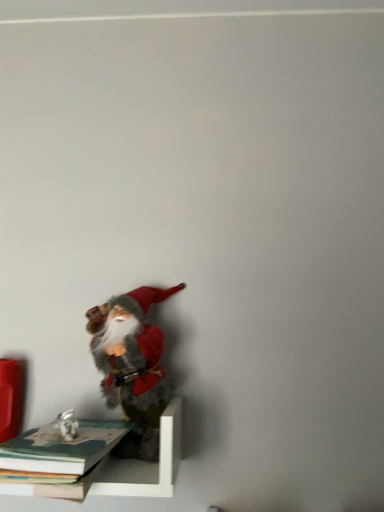
Consider the image. Measure the distance between hardcover book at lower left, which appears as the second book when ordered from the bottom, and camera.

They are 60.93 centimeters apart.

How much space does hardcover book at lower left, which appears as the second book when ordered from the bottom, occupy horizontally?

The width of hardcover book at lower left, which appears as the second book when ordered from the bottom, is 11.10 inches.

Describe the element at coordinates (50, 485) in the screenshot. I see `hardcover book at lower left, positioned as the first book in bottom-to-top order` at that location.

I want to click on white matte shelf at lower left, so click(123, 470).

This screenshot has width=384, height=512. I want to click on hardcover book at lower left, which ranks as the 1th book in top-to-bottom order, so click(62, 448).

Considering the positions of objects white matte shelf at lower left and fuzzy felt santa at lower left in the image provided, who is more to the right, white matte shelf at lower left or fuzzy felt santa at lower left?

Positioned to the right is fuzzy felt santa at lower left.

From the image's perspective, is white matte shelf at lower left located above or below fuzzy felt santa at lower left?

white matte shelf at lower left is below fuzzy felt santa at lower left.

The image size is (384, 512). What are the coordinates of `person above the white matte shelf at lower left (from a real-world perspective)` in the screenshot? It's located at (132, 366).

Looking at this image, is hardcover book at lower left, which appears as the second book when ordered from the bottom, wider or thinner than fuzzy felt santa at lower left?

In the image, hardcover book at lower left, which appears as the second book when ordered from the bottom, appears to be wider than fuzzy felt santa at lower left.

Considering the sizes of objects hardcover book at lower left, which appears as the second book when ordered from the bottom, and fuzzy felt santa at lower left in the image provided, who is shorter, hardcover book at lower left, which appears as the second book when ordered from the bottom, or fuzzy felt santa at lower left?

With less height is hardcover book at lower left, which appears as the second book when ordered from the bottom.

Considering the sizes of hardcover book at lower left, which appears as the second book when ordered from the bottom, and fuzzy felt santa at lower left in the image, is hardcover book at lower left, which appears as the second book when ordered from the bottom, bigger or smaller than fuzzy felt santa at lower left?

hardcover book at lower left, which appears as the second book when ordered from the bottom, is smaller than fuzzy felt santa at lower left.

Is point (4, 458) closer to camera compared to point (136, 433)?

Yes, point (4, 458) is in front of point (136, 433).

Is white matte shelf at lower left closer to the viewer compared to hardcover book at lower left, which appears as the second book when ordered from the bottom?

No, white matte shelf at lower left is further to the viewer.

Can you confirm if white matte shelf at lower left is thinner than hardcover book at lower left, which appears as the second book when ordered from the bottom?

Yes, white matte shelf at lower left is thinner than hardcover book at lower left, which appears as the second book when ordered from the bottom.

Does white matte shelf at lower left have a greater height compared to hardcover book at lower left, which ranks as the 1th book in top-to-bottom order?

Indeed, white matte shelf at lower left has a greater height compared to hardcover book at lower left, which ranks as the 1th book in top-to-bottom order.

Can you tell me how much white matte shelf at lower left and hardcover book at lower left, which appears as the second book when ordered from the bottom, differ in facing direction?

2.74 degrees separate the facing orientations of white matte shelf at lower left and hardcover book at lower left, which appears as the second book when ordered from the bottom.

Consider the image. Considering the sizes of objects fuzzy felt santa at lower left and hardcover book at lower left, which is the second book from top to bottom, in the image provided, who is bigger, fuzzy felt santa at lower left or hardcover book at lower left, which is the second book from top to bottom,?

fuzzy felt santa at lower left is bigger.

Visually, is fuzzy felt santa at lower left positioned to the left or to the right of hardcover book at lower left, which is the second book from top to bottom?

Based on their positions, fuzzy felt santa at lower left is located to the right of hardcover book at lower left, which is the second book from top to bottom.

Can you confirm if fuzzy felt santa at lower left is taller than hardcover book at lower left, positioned as the first book in bottom-to-top order?

Indeed, fuzzy felt santa at lower left has a greater height compared to hardcover book at lower left, positioned as the first book in bottom-to-top order.

Is point (120, 335) closer to viewer compared to point (90, 471)?

No, it is not.

Can you tell me how much fuzzy felt santa at lower left and hardcover book at lower left, which ranks as the 1th book in top-to-bottom order, differ in facing direction?

The angular difference between fuzzy felt santa at lower left and hardcover book at lower left, which ranks as the 1th book in top-to-bottom order, is 2.45 degrees.

Looking at this image, choose the correct answer: Is fuzzy felt santa at lower left inside hardcover book at lower left, which ranks as the 1th book in top-to-bottom order, or outside it?

The correct answer is: outside.

Is fuzzy felt santa at lower left oriented away from hardcover book at lower left, which ranks as the 1th book in top-to-bottom order?

No, hardcover book at lower left, which ranks as the 1th book in top-to-bottom order, is not at the back of fuzzy felt santa at lower left.

From the image's perspective, is hardcover book at lower left, which appears as the second book when ordered from the bottom, located beneath hardcover book at lower left, which is the second book from top to bottom?

Incorrect, from the image's perspective, hardcover book at lower left, which appears as the second book when ordered from the bottom, is higher than hardcover book at lower left, which is the second book from top to bottom.

Considering the positions of points (43, 463) and (14, 482), is point (43, 463) farther from camera compared to point (14, 482)?

No, it is not.

Would you say hardcover book at lower left, which appears as the second book when ordered from the bottom, is outside hardcover book at lower left, positioned as the first book in bottom-to-top order?

Yes.

From a real-world perspective, does hardcover book at lower left, which ranks as the 1th book in top-to-bottom order, sit lower than hardcover book at lower left, which is the second book from top to bottom?

No, from a real-world perspective, hardcover book at lower left, which ranks as the 1th book in top-to-bottom order, is not under hardcover book at lower left, which is the second book from top to bottom.

Is hardcover book at lower left, which is the second book from top to bottom, turned away from hardcover book at lower left, which appears as the second book when ordered from the bottom?

No.

The height and width of the screenshot is (512, 384). Find the location of `book in front of the hardcover book at lower left, positioned as the first book in bottom-to-top order`. book in front of the hardcover book at lower left, positioned as the first book in bottom-to-top order is located at coordinates (62, 448).

Is hardcover book at lower left, which is the second book from top to bottom, far away from hardcover book at lower left, which appears as the second book when ordered from the bottom?

No, there isn't a large distance between hardcover book at lower left, which is the second book from top to bottom, and hardcover book at lower left, which appears as the second book when ordered from the bottom.

Find the location of a particular element. shelf located below the fuzzy felt santa at lower left (from the image's perspective) is located at coordinates (123, 470).

Find the location of a particular element. The height and width of the screenshot is (512, 384). person located behind the hardcover book at lower left, which appears as the second book when ordered from the bottom is located at coordinates (132, 366).

When comparing their distances from hardcover book at lower left, which appears as the second book when ordered from the bottom, does white matte shelf at lower left or hardcover book at lower left, which is the second book from top to bottom, seem further?

white matte shelf at lower left lies further to hardcover book at lower left, which appears as the second book when ordered from the bottom, than the other object.

Looking at the image, which one is located closer to hardcover book at lower left, which ranks as the 1th book in top-to-bottom order, fuzzy felt santa at lower left or hardcover book at lower left, which is the second book from top to bottom?

hardcover book at lower left, which is the second book from top to bottom.

Considering their positions, is hardcover book at lower left, which ranks as the 1th book in top-to-bottom order, positioned further to fuzzy felt santa at lower left than white matte shelf at lower left?

Among the two, hardcover book at lower left, which ranks as the 1th book in top-to-bottom order, is located further to fuzzy felt santa at lower left.

Based on their spatial positions, is white matte shelf at lower left or hardcover book at lower left, which ranks as the 1th book in top-to-bottom order, closer to hardcover book at lower left, positioned as the first book in bottom-to-top order?

Among the two, hardcover book at lower left, which ranks as the 1th book in top-to-bottom order, is located nearer to hardcover book at lower left, positioned as the first book in bottom-to-top order.

Estimate the real-world distances between objects in this image. Which object is further from fuzzy felt santa at lower left, hardcover book at lower left, positioned as the first book in bottom-to-top order, or white matte shelf at lower left?

Based on the image, hardcover book at lower left, positioned as the first book in bottom-to-top order, appears to be further to fuzzy felt santa at lower left.

Considering their positions, is fuzzy felt santa at lower left positioned closer to hardcover book at lower left, positioned as the first book in bottom-to-top order, than white matte shelf at lower left?

white matte shelf at lower left is closer to hardcover book at lower left, positioned as the first book in bottom-to-top order.

Consider the image. Looking at the image, which one is located further to hardcover book at lower left, positioned as the first book in bottom-to-top order, hardcover book at lower left, which ranks as the 1th book in top-to-bottom order, or white matte shelf at lower left?

white matte shelf at lower left lies further to hardcover book at lower left, positioned as the first book in bottom-to-top order, than the other object.

From the image, which object appears to be nearer to white matte shelf at lower left, hardcover book at lower left, which appears as the second book when ordered from the bottom, or hardcover book at lower left, positioned as the first book in bottom-to-top order?

The object closer to white matte shelf at lower left is hardcover book at lower left, positioned as the first book in bottom-to-top order.

You are a GUI agent. You are given a task and a screenshot of the screen. Output one action in this format:
    pyautogui.click(x=<x>, y=<y>)
    Task: Click on the book between fuzzy felt santa at lower left and hardcover book at lower left, positioned as the first book in bottom-to-top order, in the vertical direction
    
    Given the screenshot: What is the action you would take?
    pyautogui.click(x=62, y=448)

This screenshot has width=384, height=512. Find the location of `book located between hardcover book at lower left, which appears as the second book when ordered from the bottom, and white matte shelf at lower left in the depth direction`. book located between hardcover book at lower left, which appears as the second book when ordered from the bottom, and white matte shelf at lower left in the depth direction is located at coordinates [50, 485].

This screenshot has width=384, height=512. Find the location of `shelf that lies between fuzzy felt santa at lower left and hardcover book at lower left, which is the second book from top to bottom, from top to bottom`. shelf that lies between fuzzy felt santa at lower left and hardcover book at lower left, which is the second book from top to bottom, from top to bottom is located at coordinates (123, 470).

You are a GUI agent. You are given a task and a screenshot of the screen. Output one action in this format:
    pyautogui.click(x=<x>, y=<y>)
    Task: Click on the book between fuzzy felt santa at lower left and white matte shelf at lower left vertically
    This screenshot has height=512, width=384.
    Given the screenshot: What is the action you would take?
    pyautogui.click(x=62, y=448)